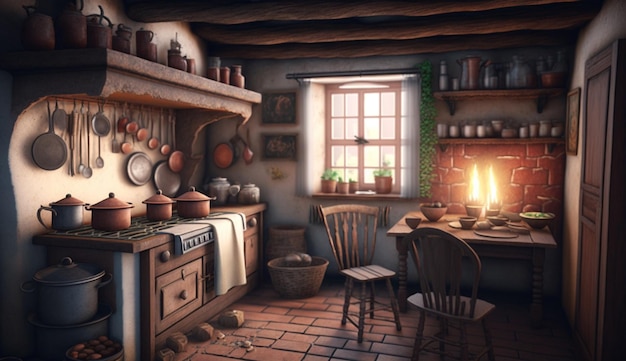
Image resolution: width=626 pixels, height=361 pixels. In order to click on shelf over stove in this screenshot , I will do `click(151, 76)`.